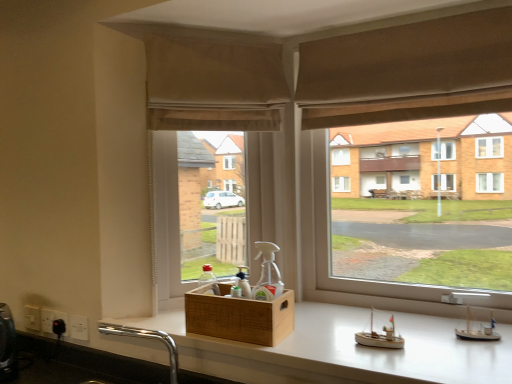
Question: Can you confirm if beige fabric window screen at center is taller than white glossy counter at center?

Choices:
 (A) yes
 (B) no

Answer: (A)

Question: Can you confirm if beige fabric window screen at center is shorter than white glossy counter at center?

Choices:
 (A) yes
 (B) no

Answer: (B)

Question: From the image's perspective, is beige fabric window screen at center above white glossy counter at center?

Choices:
 (A) yes
 (B) no

Answer: (A)

Question: Is beige fabric window screen at center not near white glossy counter at center?

Choices:
 (A) no
 (B) yes

Answer: (A)

Question: From the image's perspective, is beige fabric window screen at center below white glossy counter at center?

Choices:
 (A) yes
 (B) no

Answer: (B)

Question: Considering the relative positions of beige fabric window screen at center and white glossy counter at center in the image provided, is beige fabric window screen at center to the left of white glossy counter at center from the viewer's perspective?

Choices:
 (A) yes
 (B) no

Answer: (A)

Question: Is matte brown curtain at center thinner than white glossy counter at center?

Choices:
 (A) yes
 (B) no

Answer: (A)

Question: Does matte brown curtain at center come behind white glossy counter at center?

Choices:
 (A) yes
 (B) no

Answer: (A)

Question: Is matte brown curtain at center at the left side of white glossy counter at center?

Choices:
 (A) yes
 (B) no

Answer: (B)

Question: From a real-world perspective, does matte brown curtain at center sit lower than white glossy counter at center?

Choices:
 (A) no
 (B) yes

Answer: (A)

Question: Can you confirm if matte brown curtain at center is taller than white glossy counter at center?

Choices:
 (A) yes
 (B) no

Answer: (A)

Question: Would you say matte brown curtain at center is a long distance from white glossy counter at center?

Choices:
 (A) no
 (B) yes

Answer: (A)

Question: Does beige fabric window screen at center have a greater height compared to brown fabric curtain at upper center?

Choices:
 (A) no
 (B) yes

Answer: (B)